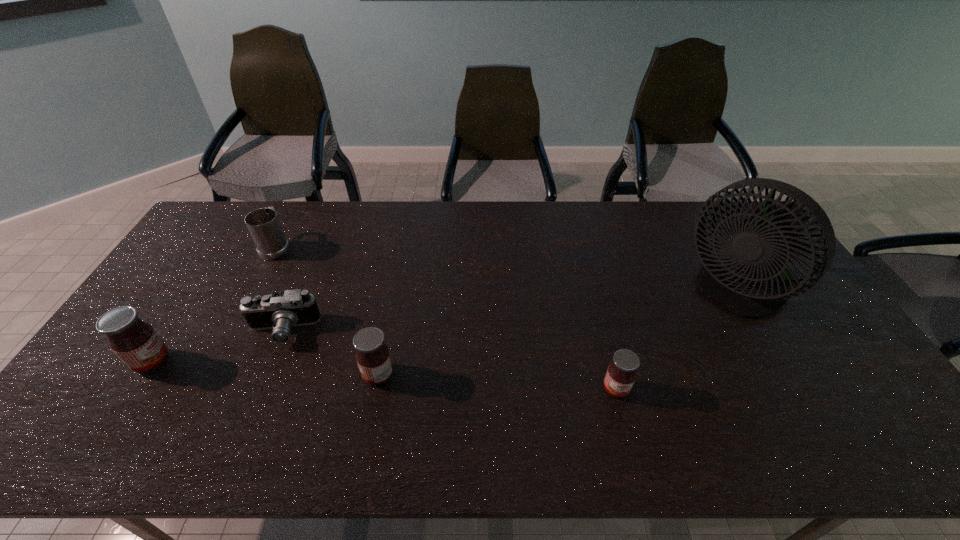
The image size is (960, 540). In order to click on vacant space situated on the label side of the fourth object from left to right in this screenshot , I will do `click(258, 375)`.

This screenshot has height=540, width=960. What are the coordinates of `vacant space located 0.320m on the label side of the fourth object from left to right` in the screenshot? It's located at (239, 375).

Locate an element on the screen. This screenshot has height=540, width=960. vacant region located 0.180m on the label side of the fourth object from left to right is located at coordinates (293, 375).

What are the coordinates of `vacant space located 0.080m on the side of the mug with the handle` in the screenshot? It's located at (291, 219).

The width and height of the screenshot is (960, 540). I want to click on vacant space situated 0.190m on the side of the mug with the handle, so click(x=300, y=202).

Locate an element on the screen. This screenshot has height=540, width=960. free spot located on the side of the mug with the handle is located at coordinates (289, 222).

Locate an element on the screen. The height and width of the screenshot is (540, 960). vacant region located at the lens of the camera is located at coordinates (262, 381).

The height and width of the screenshot is (540, 960). Identify the location of vacant space positioned in front of the tallest object to direct airflow. (606, 293).

You are a GUI agent. You are given a task and a screenshot of the screen. Output one action in this format:
    pyautogui.click(x=<x>, y=<y>)
    Task: Click on the vacant area situated in front of the tallest object to direct airflow
    The image size is (960, 540).
    Given the screenshot: What is the action you would take?
    pyautogui.click(x=610, y=293)

The image size is (960, 540). What are the coordinates of `free space located in front of the tallest object to direct airflow` in the screenshot? It's located at (606, 293).